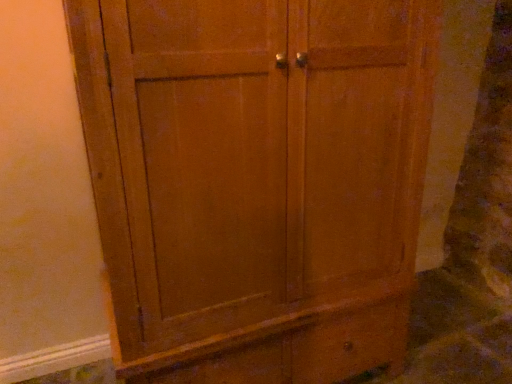
What do you see at coordinates (256, 181) in the screenshot? Image resolution: width=512 pixels, height=384 pixels. I see `matte wood cupboard at center` at bounding box center [256, 181].

Measure the distance between matte wood cupboard at center and camera.

The depth of matte wood cupboard at center is 32.80 inches.

You are a GUI agent. You are given a task and a screenshot of the screen. Output one action in this format:
    pyautogui.click(x=<x>, y=<y>)
    Task: Click on the matte wood cupboard at center
    The height and width of the screenshot is (384, 512).
    Given the screenshot: What is the action you would take?
    pyautogui.click(x=256, y=181)

Find the location of a particular element. The height and width of the screenshot is (384, 512). matte wood cupboard at center is located at coordinates (256, 181).